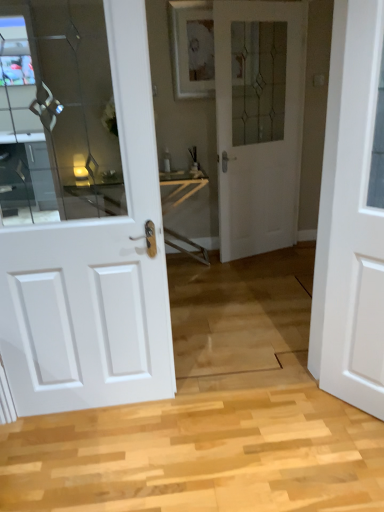
Question: Can white matte door at right, placed as the 1th door when sorted from front to back, be found inside white glass door at center, the third door positioned from the front?

Choices:
 (A) no
 (B) yes

Answer: (A)

Question: Is white glass door at center, the second door in the right-to-left sequence, positioned beyond the bounds of white matte door at right, marked as the third door in a back-to-front arrangement?

Choices:
 (A) no
 (B) yes

Answer: (B)

Question: Does white glass door at center, the second door in the right-to-left sequence, come in front of white matte door at right, placed as the 1th door when sorted from front to back?

Choices:
 (A) yes
 (B) no

Answer: (B)

Question: From the image's perspective, is white glass door at center, the 1th door when ordered from back to front, on white matte door at right, marked as the 3th door in a left-to-right arrangement?

Choices:
 (A) no
 (B) yes

Answer: (B)

Question: Considering the relative sizes of white glass door at center, which ranks as the 2th door in left-to-right order, and white matte door at right, marked as the first door in a right-to-left arrangement, in the image provided, is white glass door at center, which ranks as the 2th door in left-to-right order, thinner than white matte door at right, marked as the first door in a right-to-left arrangement,?

Choices:
 (A) yes
 (B) no

Answer: (A)

Question: Does white glass door at center, the second door in the right-to-left sequence, have a greater width compared to white matte door at right, marked as the first door in a right-to-left arrangement?

Choices:
 (A) yes
 (B) no

Answer: (B)

Question: Is white glass door at center, the third door positioned from the front, bigger than white glossy door at left, placed as the 2th door when sorted from back to front?

Choices:
 (A) yes
 (B) no

Answer: (A)

Question: From a real-world perspective, is white glass door at center, which ranks as the 2th door in left-to-right order, physically below white glossy door at left, placed as the 2th door when sorted from back to front?

Choices:
 (A) yes
 (B) no

Answer: (B)

Question: Considering the relative sizes of white glass door at center, the second door in the right-to-left sequence, and white glossy door at left, positioned as the second door in front-to-back order, in the image provided, is white glass door at center, the second door in the right-to-left sequence, wider than white glossy door at left, positioned as the second door in front-to-back order,?

Choices:
 (A) no
 (B) yes

Answer: (A)

Question: Is white glass door at center, the second door in the right-to-left sequence, facing away from white glossy door at left, the first door viewed from the left?

Choices:
 (A) no
 (B) yes

Answer: (A)

Question: Is the position of white glass door at center, the 1th door when ordered from back to front, more distant than that of white glossy door at left, placed as the 2th door when sorted from back to front?

Choices:
 (A) yes
 (B) no

Answer: (A)

Question: Is white glass door at center, the third door positioned from the front, positioned before white glossy door at left, positioned as the second door in front-to-back order?

Choices:
 (A) no
 (B) yes

Answer: (A)

Question: From a real-world perspective, is white glossy door at left, positioned as the second door in front-to-back order, physically below white matte door at right, marked as the first door in a right-to-left arrangement?

Choices:
 (A) yes
 (B) no

Answer: (B)